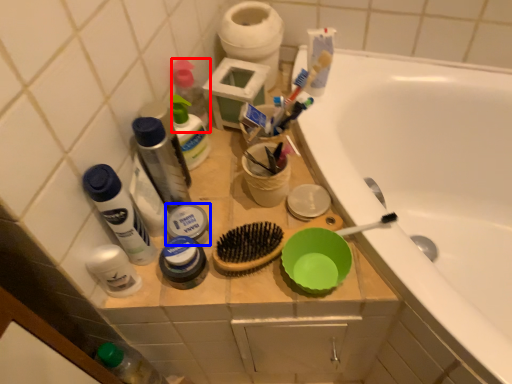
Question: Which point is closer to the camera, toiletry (highlighted by a red box) or toiletry (highlighted by a blue box)?

Choices:
 (A) toiletry
 (B) toiletry

Answer: (B)